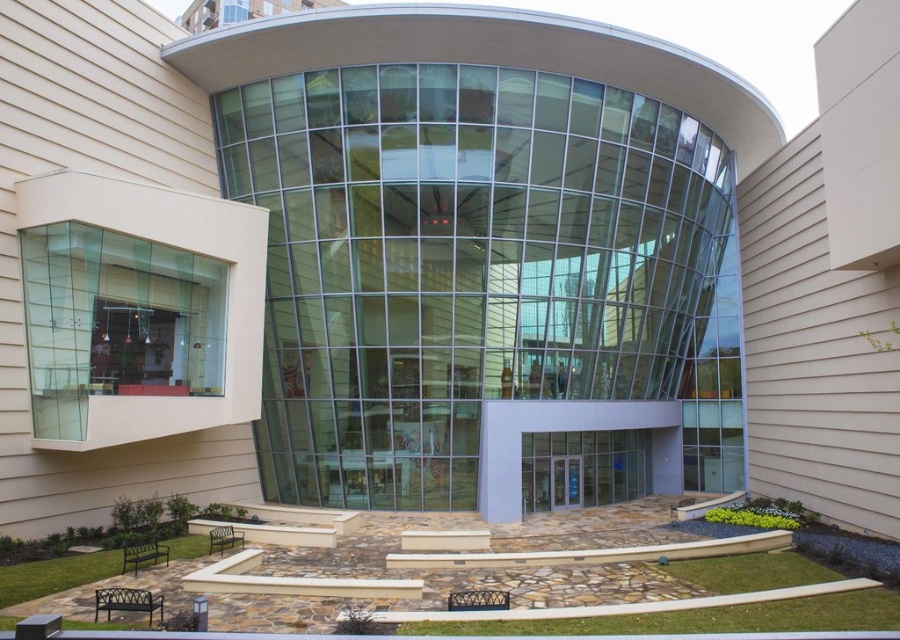
Between clear glass doors at center and clear glass door at center, which one appears on the right side from the viewer's perspective?

From the viewer's perspective, clear glass doors at center appears more on the right side.

Between point (572, 480) and point (562, 488), which one is positioned behind?

Point (572, 480)

The height and width of the screenshot is (640, 900). Identify the location of clear glass doors at center. (585, 467).